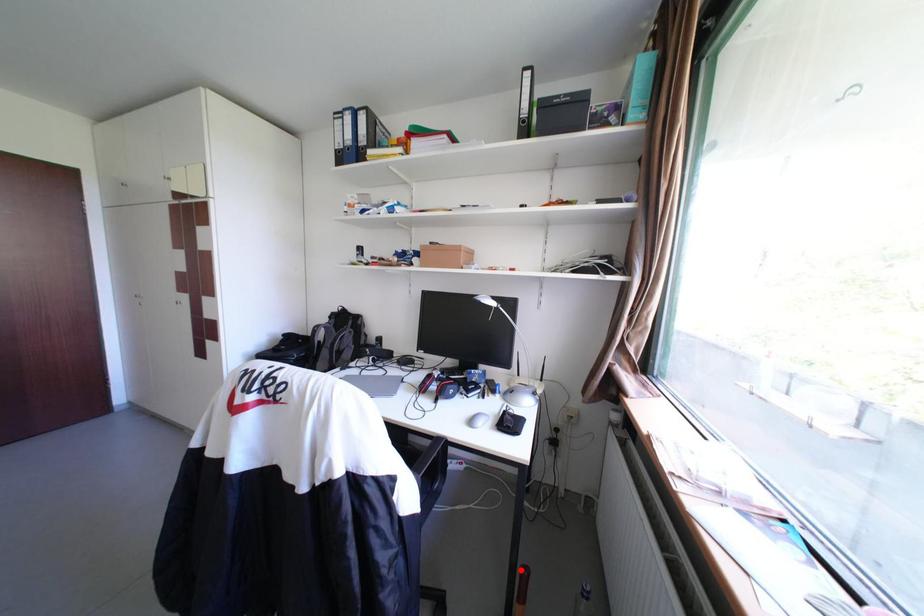
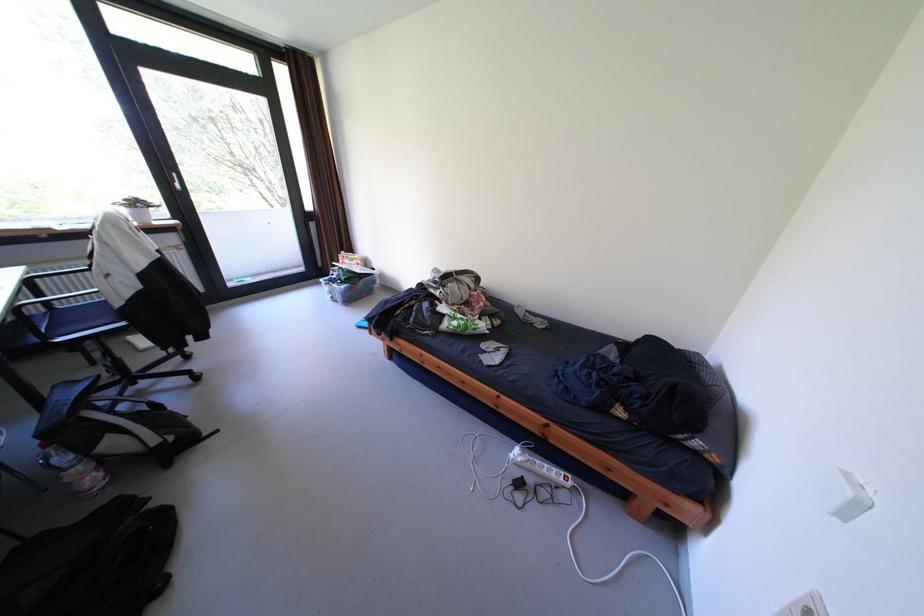
Question: I am providing you with two images of the same scene from different viewpoints. A red point is marked on the first image. At the location where the point appears in image 1, is it still visible in image 2?

Choices:
 (A) Yes
 (B) No

Answer: (B)